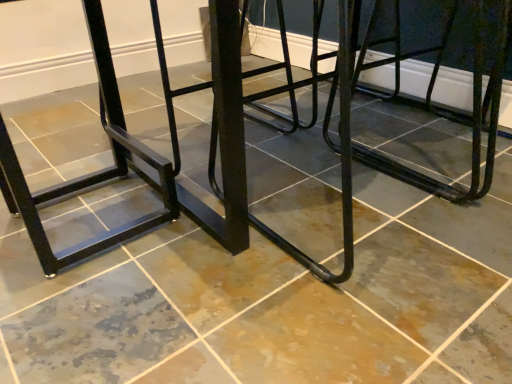
Question: From a real-world perspective, is black matte metal bar stool at left located beneath black metal table at center?

Choices:
 (A) yes
 (B) no

Answer: (A)

Question: Does black matte metal bar stool at left have a greater height compared to black metal table at center?

Choices:
 (A) yes
 (B) no

Answer: (A)

Question: From the image's perspective, does black matte metal bar stool at left appear lower than black metal table at center?

Choices:
 (A) no
 (B) yes

Answer: (B)

Question: Is black matte metal bar stool at left further to the viewer compared to black metal table at center?

Choices:
 (A) yes
 (B) no

Answer: (A)

Question: Is black matte metal bar stool at left closer to the viewer compared to black metal table at center?

Choices:
 (A) yes
 (B) no

Answer: (B)

Question: Does black matte metal bar stool at left have a larger size compared to black metal table at center?

Choices:
 (A) yes
 (B) no

Answer: (B)

Question: From a real-world perspective, is black metal table at center below black matte metal bar stool at left?

Choices:
 (A) no
 (B) yes

Answer: (A)

Question: Would you say black matte metal bar stool at left is part of black metal table at center's contents?

Choices:
 (A) no
 (B) yes

Answer: (B)

Question: Can you confirm if black metal table at center is taller than black matte metal bar stool at left?

Choices:
 (A) yes
 (B) no

Answer: (B)

Question: From a real-world perspective, is black metal table at center located higher than black matte metal bar stool at left?

Choices:
 (A) yes
 (B) no

Answer: (A)

Question: Considering the relative positions of black metal table at center and black matte metal bar stool at left in the image provided, is black metal table at center to the right of black matte metal bar stool at left from the viewer's perspective?

Choices:
 (A) no
 (B) yes

Answer: (B)

Question: Is black metal table at center positioned beyond the bounds of black matte metal bar stool at left?

Choices:
 (A) no
 (B) yes

Answer: (B)

Question: Is black metal table at center bigger or smaller than black matte metal bar stool at left?

Choices:
 (A) big
 (B) small

Answer: (A)